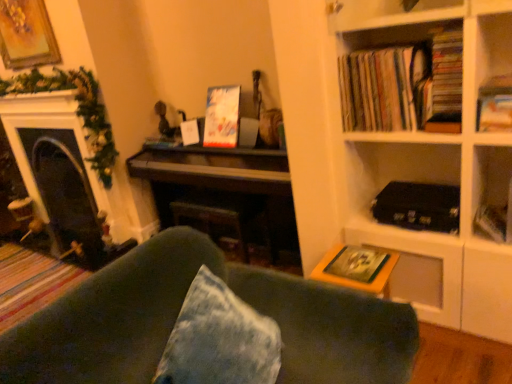
Question: From a real-world perspective, does matte black fireplace at left stand above matte cardboard books at upper right, which appears as the 1th book when viewed from the left?

Choices:
 (A) yes
 (B) no

Answer: (B)

Question: Is matte black fireplace at left next to matte cardboard books at upper right, which appears as the 1th book when viewed from the left?

Choices:
 (A) no
 (B) yes

Answer: (A)

Question: From the image's perspective, is matte black fireplace at left on matte cardboard books at upper right, which appears as the 1th book when viewed from the left?

Choices:
 (A) yes
 (B) no

Answer: (B)

Question: Is matte black fireplace at left positioned in front of matte cardboard books at upper right, which appears as the 1th book when viewed from the left?

Choices:
 (A) no
 (B) yes

Answer: (A)

Question: Can you confirm if matte black fireplace at left is thinner than matte cardboard books at upper right, which appears as the 1th book when viewed from the left?

Choices:
 (A) no
 (B) yes

Answer: (A)

Question: In the image, is green fabric couch at lower center positioned in front of or behind yellow matte paperback book at lower right, the 1th paperback book positioned from the bottom?

Choices:
 (A) front
 (B) behind

Answer: (A)

Question: Is green fabric couch at lower center spatially inside yellow matte paperback book at lower right, marked as the 2th paperback book in a left-to-right arrangement, or outside of it?

Choices:
 (A) inside
 (B) outside

Answer: (B)

Question: Is green fabric couch at lower center to the left or to the right of yellow matte paperback book at lower right, marked as the 2th paperback book in a left-to-right arrangement, in the image?

Choices:
 (A) left
 (B) right

Answer: (A)

Question: In terms of size, does green fabric couch at lower center appear bigger or smaller than yellow matte paperback book at lower right, positioned as the 3th paperback book in back-to-front order?

Choices:
 (A) big
 (B) small

Answer: (A)

Question: Considering the positions of point (504, 236) and point (358, 105), is point (504, 236) closer or farther from the camera than point (358, 105)?

Choices:
 (A) farther
 (B) closer

Answer: (B)

Question: From their relative heights in the image, would you say hardcover book at upper right, acting as the second paperback book starting from the back, is taller or shorter than matte cardboard books at upper right, which appears as the second book when viewed from the right?

Choices:
 (A) tall
 (B) short

Answer: (B)

Question: From a real-world perspective, is hardcover book at upper right, which is the 2th paperback book in front-to-back order, physically located above or below matte cardboard books at upper right, which appears as the second book when viewed from the right?

Choices:
 (A) below
 (B) above

Answer: (A)

Question: From the image's perspective, is hardcover book at upper right, which is the 2th paperback book in front-to-back order, above or below matte cardboard books at upper right, which appears as the 1th book when viewed from the left?

Choices:
 (A) above
 (B) below

Answer: (B)

Question: Is hardcover book at upper right, acting as the second paperback book starting from the back, inside the boundaries of yellow matte paperback book at lower right, the 1th paperback book positioned from the bottom, or outside?

Choices:
 (A) inside
 (B) outside

Answer: (B)

Question: From the image's perspective, is hardcover book at upper right, which is counted as the 1th paperback book, starting from the right, located above or below yellow matte paperback book at lower right, the 1th paperback book positioned from the bottom?

Choices:
 (A) below
 (B) above

Answer: (B)